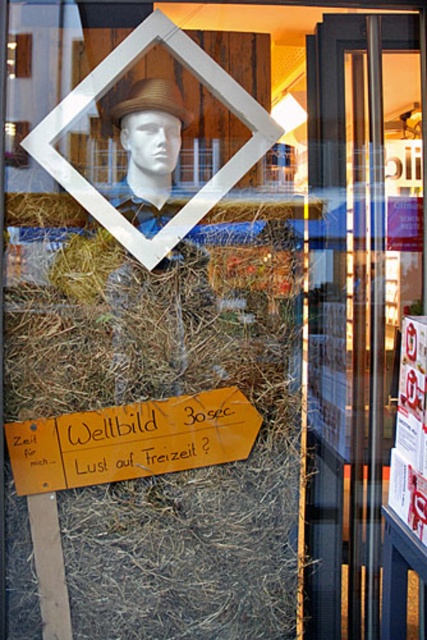
You are a tourist in Germany and see the storefront with the transparent glass door at right and the orange paper sign at lower center. You want to enter the store. Which object should you pass through to get inside?

The transparent glass door at right is bigger than the orange paper sign at lower center, so you should pass through the transparent glass door at right to enter the store.

You are a delivery person trying to enter the store through the transparent glass door at right. The brown straw hat at upper center is blocking your view. Can you see the entrance clearly?

The transparent glass door at right is taller than brown straw hat at upper center, so the door is taller and may provide a clear view beyond the hat, allowing you to see the entrance clearly.

You are a customer looking at the storefront window display. You see the wooden signboard at center and the brown straw hat at upper center. Which object is closer to you?

The wooden signboard at center is closer to you because the brown straw hat at upper center is behind it.